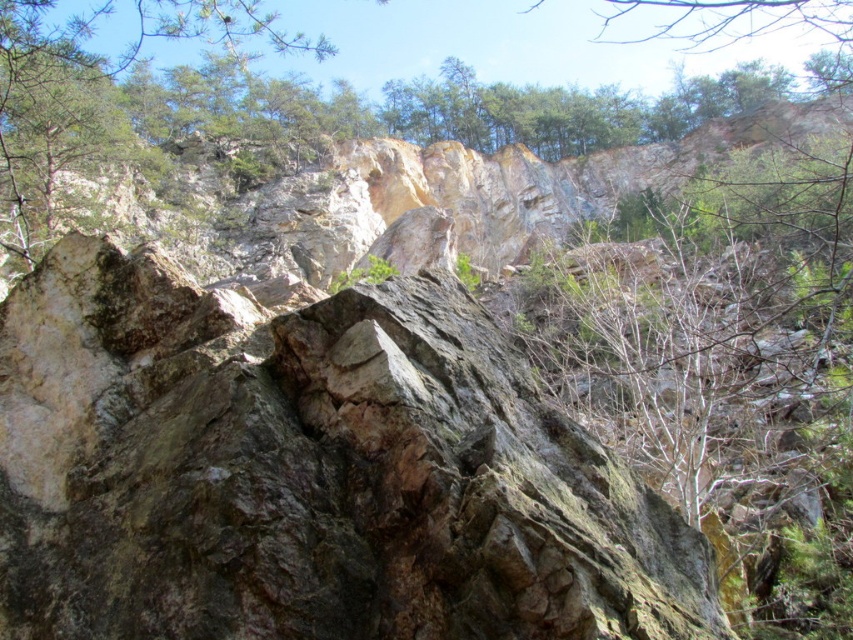
You are standing in the rugged, rocky landscape described. You need to locate the green leafy tree at upper center. According to the coordinates provided, where exactly would you look to find it?

The green leafy tree at upper center is located at point coordinates of (x=315, y=144).

You are standing in the rugged, rocky landscape and want to take a photo of the green leafy tree at upper center. Which direction should you look relative to the rocky cliff at center?

The rocky cliff at center is located below the green leafy tree at upper center, so you should look upward toward the green leafy tree at upper center above the rocky cliff at center.

You are an explorer trying to navigate through this rocky landscape. You notice a green leafy tree at upper center and a green rough rock at upper left. Which object would you estimate to be wider when viewed from above?

The green leafy tree at upper center is wider than the green rough rock at upper left based on their comparative widths.